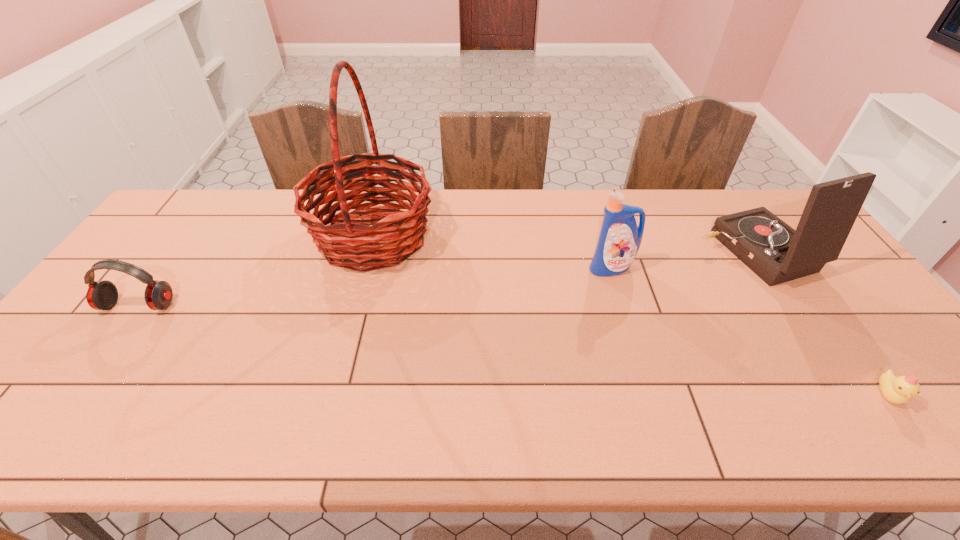
At what (x,y) coordinates should I click in order to perform the action: click on free space located on the front of the fourth shortest object. Please return your answer as a coordinate pair (x, y). The image size is (960, 540). Looking at the image, I should click on (796, 316).

I want to click on blank space located on the label of the third object from right to left, so click(639, 359).

Where is `blank space located 0.200m on the ear cups of the fourth farthest object`? Image resolution: width=960 pixels, height=540 pixels. blank space located 0.200m on the ear cups of the fourth farthest object is located at coordinates (83, 383).

In order to click on free space located on the front-facing side of the nearest object in this screenshot , I will do `click(919, 438)`.

The width and height of the screenshot is (960, 540). Find the location of `basket located at the far edge`. basket located at the far edge is located at coordinates (347, 242).

The height and width of the screenshot is (540, 960). Find the location of `phonograph record at the far edge`. phonograph record at the far edge is located at coordinates (774, 251).

At what (x,y) coordinates should I click in order to perform the action: click on object present at the near edge. Please return your answer as a coordinate pair (x, y). Image resolution: width=960 pixels, height=540 pixels. Looking at the image, I should click on (898, 390).

You are a GUI agent. You are given a task and a screenshot of the screen. Output one action in this format:
    pyautogui.click(x=<x>, y=<y>)
    Task: Click on the object at the left edge
    Image resolution: width=960 pixels, height=540 pixels.
    Given the screenshot: What is the action you would take?
    pyautogui.click(x=101, y=295)

The width and height of the screenshot is (960, 540). I want to click on phonograph record positioned at the right edge, so click(x=774, y=251).

You are a GUI agent. You are given a task and a screenshot of the screen. Output one action in this format:
    pyautogui.click(x=<x>, y=<y>)
    Task: Click on the duckling that is at the right edge
    
    Given the screenshot: What is the action you would take?
    pyautogui.click(x=898, y=390)